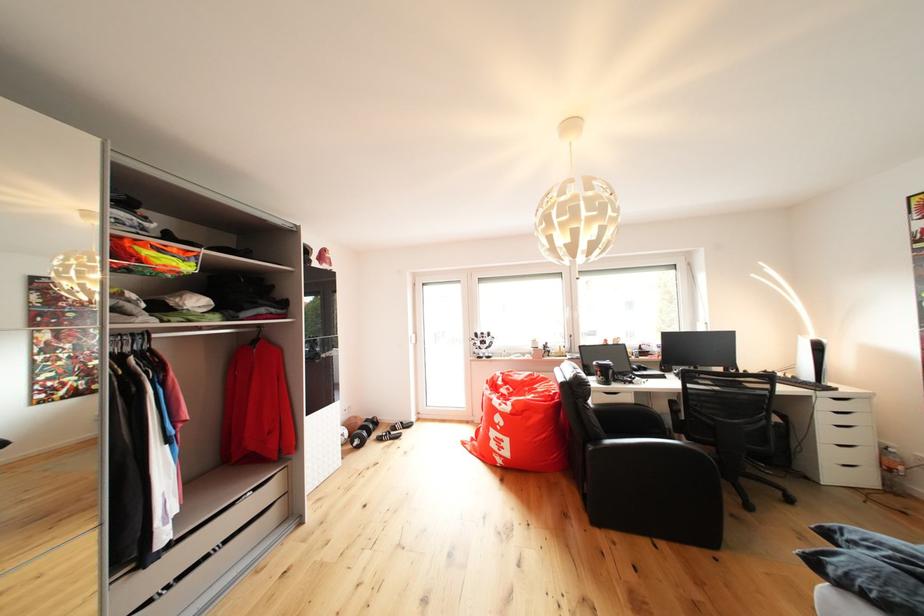
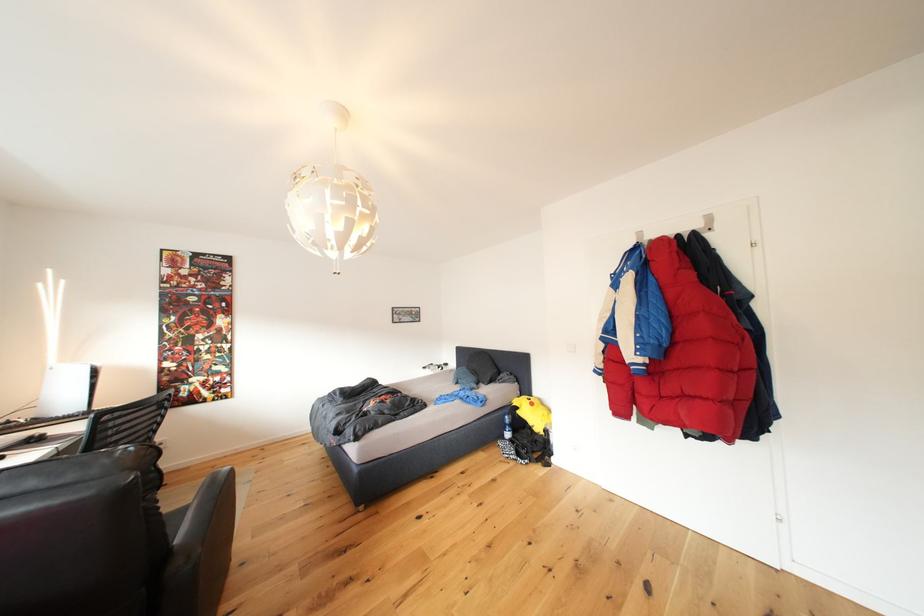
Question: I am providing you with two images of the same scene from different viewpoints. Please identify which objects are invisible in image2.

Choices:
 (A) lamp pull cord
 (B) white drawer pull
 (C) metal coat hook
 (D) blue detergent handle

Answer: (B)